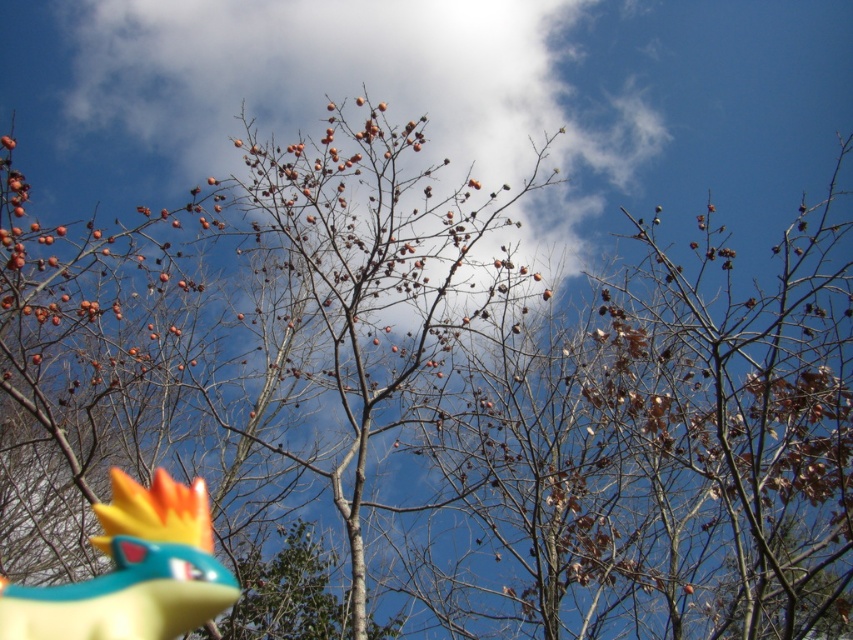
Question: Where is white fluffy cloud at upper center located in relation to yellow rubber toy at lower left in the image?

Choices:
 (A) left
 (B) right

Answer: (B)

Question: Can you confirm if white fluffy cloud at upper center is positioned above yellow rubber toy at lower left?

Choices:
 (A) yes
 (B) no

Answer: (A)

Question: Can you confirm if white fluffy cloud at upper center is wider than yellow rubber toy at lower left?

Choices:
 (A) no
 (B) yes

Answer: (B)